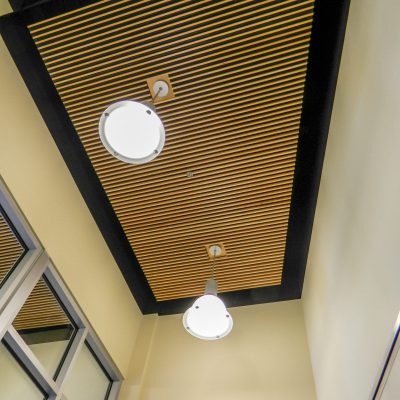
Image resolution: width=400 pixels, height=400 pixels. In order to click on mirror in this screenshot , I will do `click(42, 322)`, `click(3, 254)`, `click(25, 382)`, `click(87, 382)`.